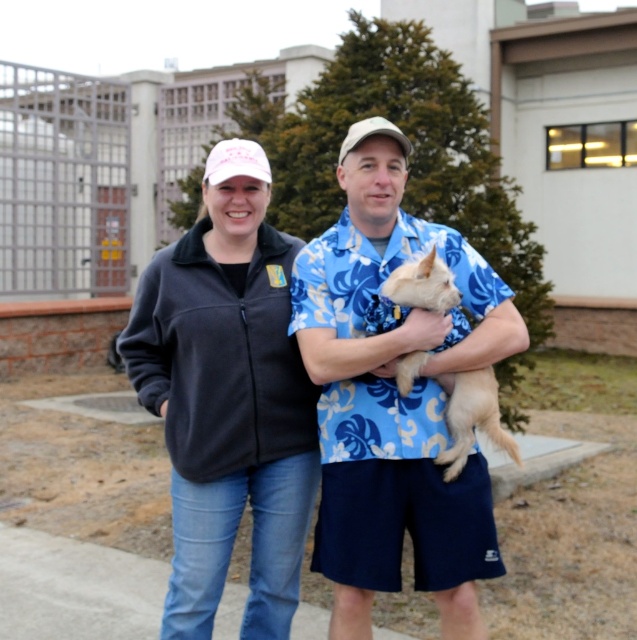
You are standing at the origin of a coordinate system where the bottom left corner of the image is the origin point. The person wearing a black fleece jacket at center is located at point [227,400]. If you want to walk directly to the person wearing the black fleece jacket at center, in which direction should you move?

You should move towards the point with coordinates [227,400] to reach the person wearing the black fleece jacket at center.

You are standing in a courtyard and want to take a photo of the matte black jacket at center and the fuzzy beige dog at center. Which object should you focus on first to ensure both are in focus?

You should focus on the matte black jacket at center first because it is closer to you than the fuzzy beige dog at center, so adjusting focus from near to far will help both be in focus.

You are a fashion stylist helping someone choose between two jackets for a casual outdoor event. The person wants to know which jacket is on the right side. Looking at the image, which jacket is positioned to the right between the matte black jacket at center and the black fleece jacket at center?

The matte black jacket at center is positioned on the right side of the black fleece jacket at center, so the matte black jacket at center is the one on the right.